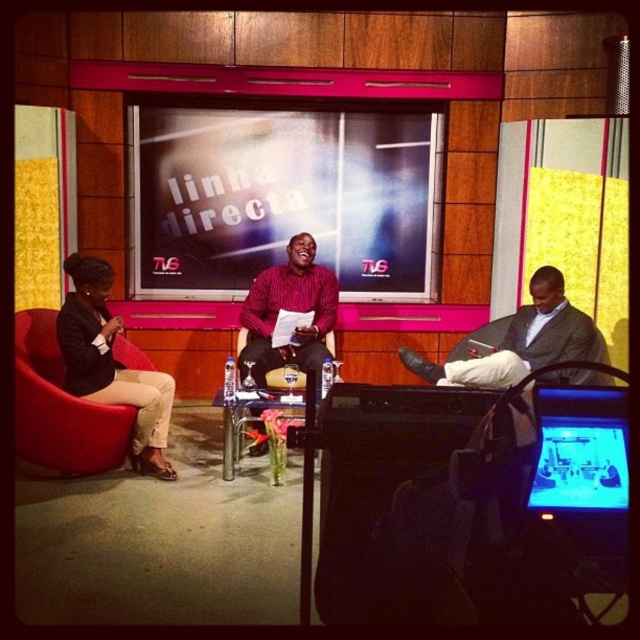
In the TV studio scene, there are two main objects of interest. One is the matte red shirt at center, and the other is the black leather armchair at center. From the perspective of someone watching the live broadcast, which object is positioned to the right side?

The matte red shirt at center is to the right of the black leather armchair at center, so from the viewer perspective, the matte red shirt at center is on the right side.

In the scene shown: You are a stagehand adjusting the lighting for a live show. You need to position a spotlight that has a 6 inch diameter beam. The spotlight must be placed so it can illuminate both the matte red shirt at center and the black leather armchair at center without overlapping the beam on any other objects. Is this possible given their current positions?

The distance between the matte red shirt at center and the black leather armchair at center is 6.33 inches. Since the spotlight beam is 6 inches in diameter, the beam cannot cover both objects simultaneously as the distance exceeds the beam width. Therefore, it is not possible to illuminate both without overlapping onto other areas.